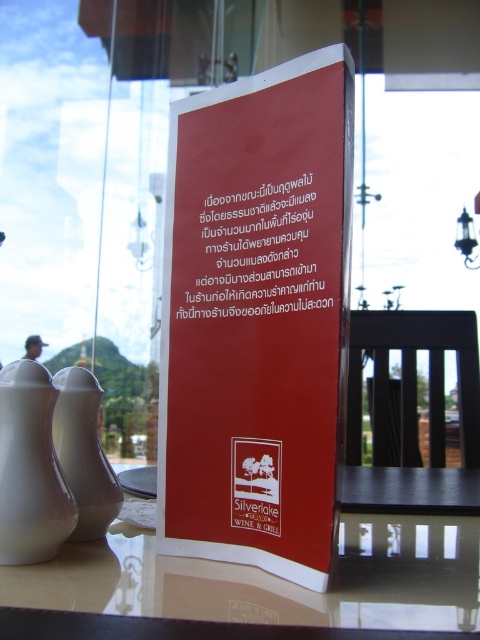
Question: Which object is closer to the camera taking this photo?

Choices:
 (A) white ceramic tea pot at lower left
 (B) matte red sign at center
 (C) white glossy tea pot at lower left

Answer: (B)

Question: Which point is closer to the camera taking this photo?

Choices:
 (A) (14, 518)
 (B) (443, 468)
 (C) (247, 282)
 (D) (334, 204)

Answer: (D)

Question: Observing the image, what is the correct spatial positioning of glossy glass table at center in reference to matte red sign at center?

Choices:
 (A) left
 (B) right

Answer: (B)

Question: Is red matte sign at center in front of white glossy tea pot at lower left?

Choices:
 (A) no
 (B) yes

Answer: (B)

Question: Which object appears farthest from the camera in this image?

Choices:
 (A) glossy glass table at center
 (B) matte red sign at center

Answer: (B)

Question: Can you confirm if glossy glass table at center is positioned below white glossy tea pot at lower left?

Choices:
 (A) no
 (B) yes

Answer: (B)